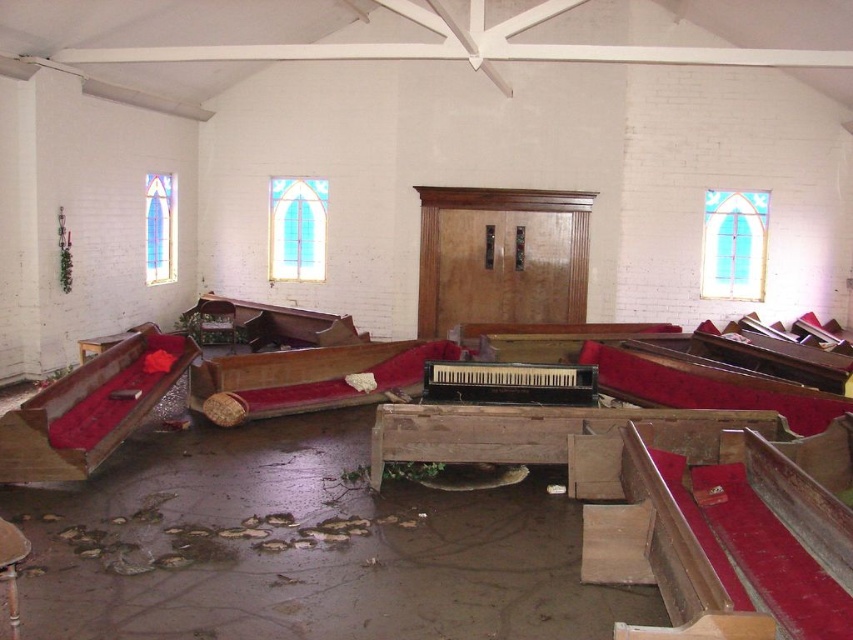
This screenshot has width=853, height=640. Describe the element at coordinates (88, 410) in the screenshot. I see `wooden polished bench at left` at that location.

Between point (144, 397) and point (566, 49), which one is positioned behind?

The point (566, 49) is behind.

Which is behind, point (125, 420) or point (714, 54)?

The point (714, 54) is behind.

The image size is (853, 640). I want to click on wooden polished bench at left, so click(88, 410).